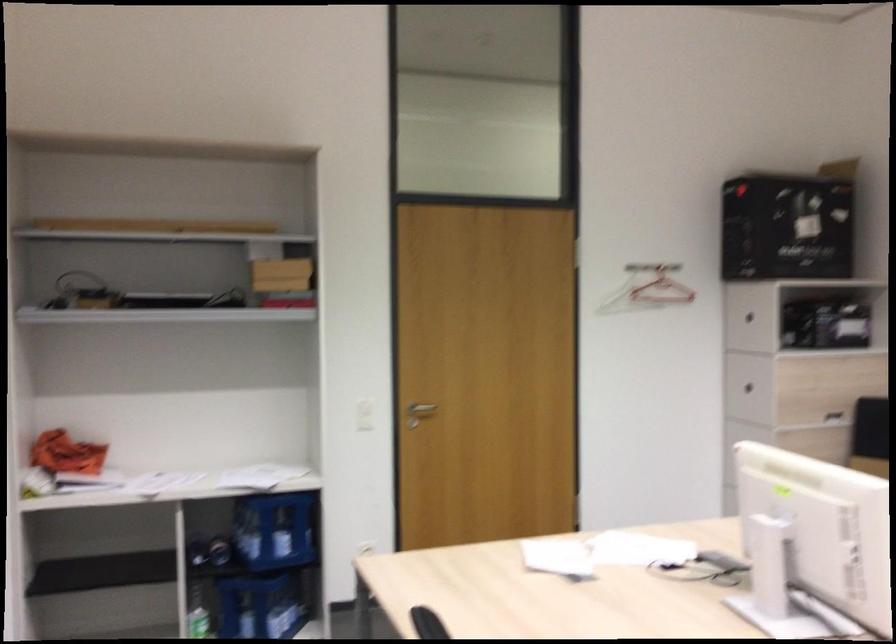
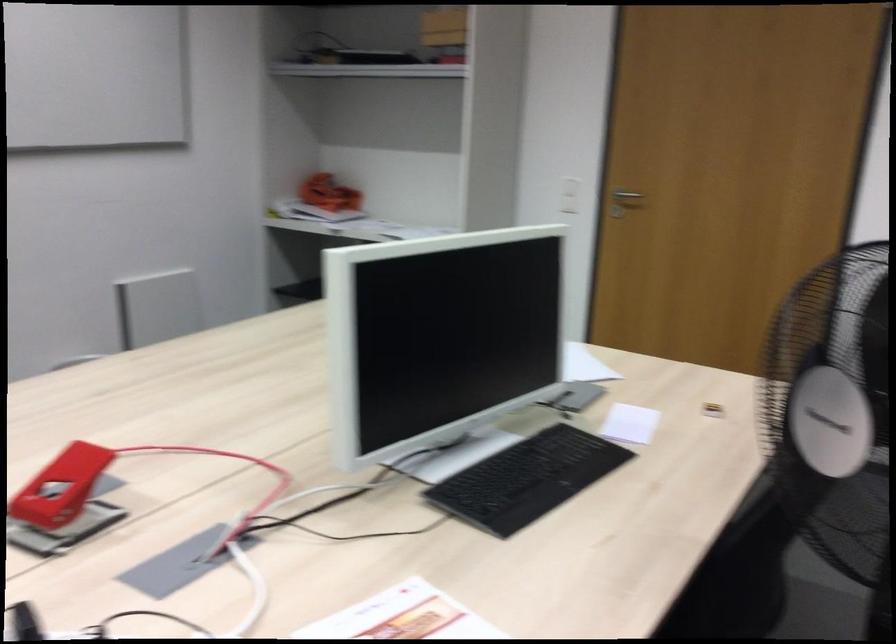
Where in the second image is the point corresponding to point 337,426 from the first image?

(569, 194)